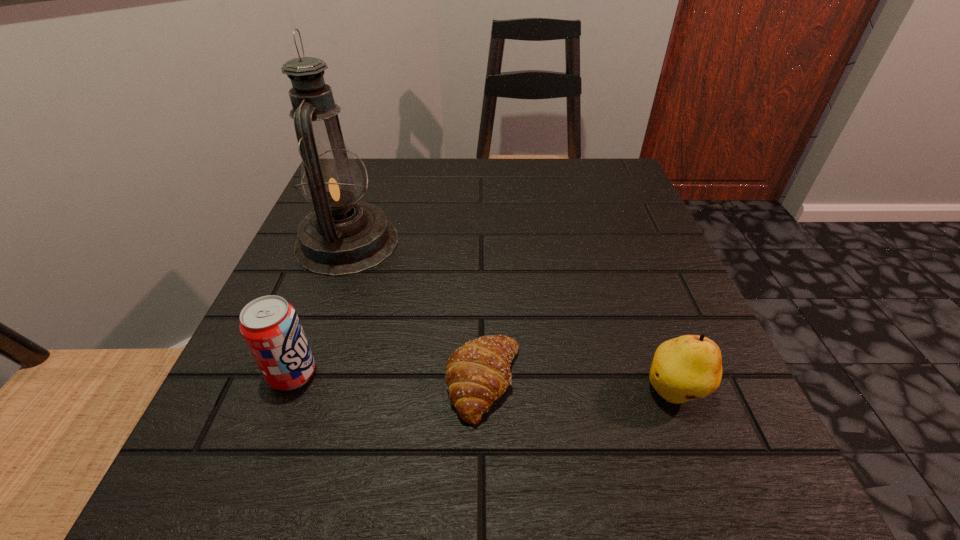
At what (x,y) coordinates should I click in order to perform the action: click on vacant space that satisfies the following two spatial constraints: 1. on the back side of the oil lamp; 2. on the right side of the soda can. Please return your answer as a coordinate pair (x, y). The image size is (960, 540). Looking at the image, I should click on (343, 242).

Find the location of a particular element. The image size is (960, 540). vacant area in the image that satisfies the following two spatial constraints: 1. on the front side of the farthest object; 2. on the right side of the rightmost object is located at coordinates (293, 392).

At what (x,y) coordinates should I click in order to perform the action: click on vacant space that satisfies the following two spatial constraints: 1. on the front side of the rightmost object; 2. on the right side of the soda can. Please return your answer as a coordinate pair (x, y). The image size is (960, 540). Looking at the image, I should click on (286, 392).